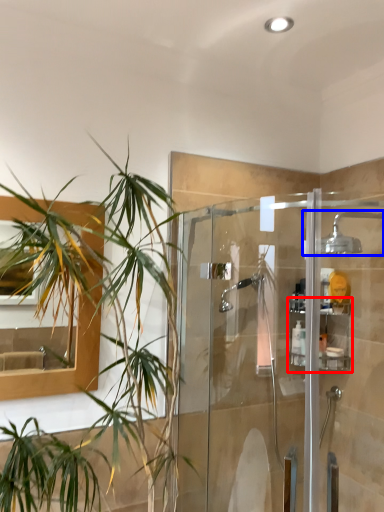
Question: Which object appears closest to the camera in this image, shelf (highlighted by a red box) or shower (highlighted by a blue box)?

Choices:
 (A) shelf
 (B) shower

Answer: (B)